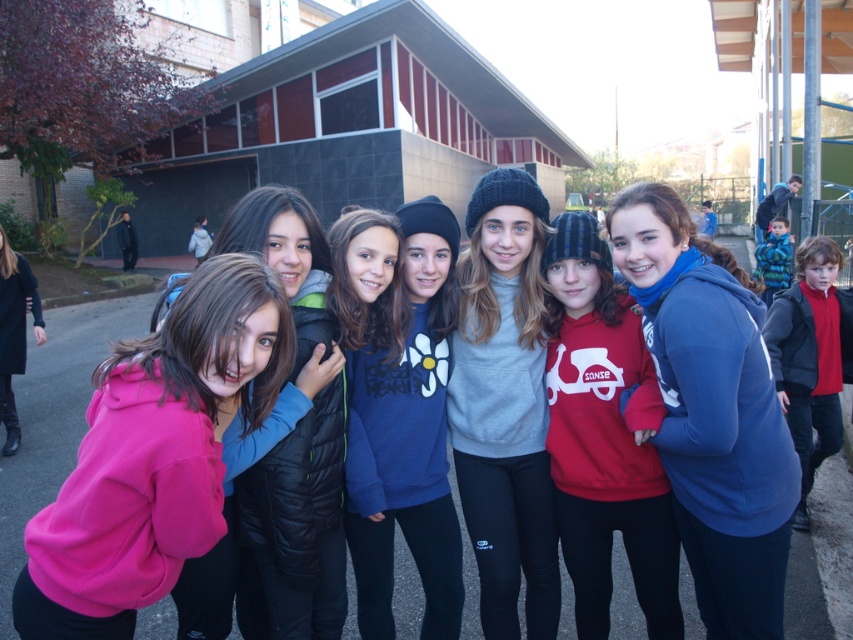
Is gray knit beanie at center shorter than blue fleece sweatshirt at center?

Incorrect, gray knit beanie at center's height does not fall short of blue fleece sweatshirt at center's.

Does gray knit beanie at center have a larger size compared to blue fleece sweatshirt at center?

Yes.

Based on the photo, who is more distant from viewer, (471, 336) or (387, 404)?

Positioned behind is point (471, 336).

At what (x,y) coordinates should I click in order to perform the action: click on gray knit beanie at center. Please return your answer as a coordinate pair (x, y). Looking at the image, I should click on (503, 404).

Is blue fleece sweatshirt at center wider than red fleece jacket at right?

In fact, blue fleece sweatshirt at center might be narrower than red fleece jacket at right.

What are the coordinates of `blue fleece sweatshirt at center` in the screenshot? It's located at (405, 442).

Locate an element on the screen. blue fleece sweatshirt at center is located at coordinates (405, 442).

Is point (181, 612) farther from camera compared to point (419, 320)?

No, (181, 612) is in front of (419, 320).

The width and height of the screenshot is (853, 640). I want to click on pink fleece sweatshirt at center, so click(155, 456).